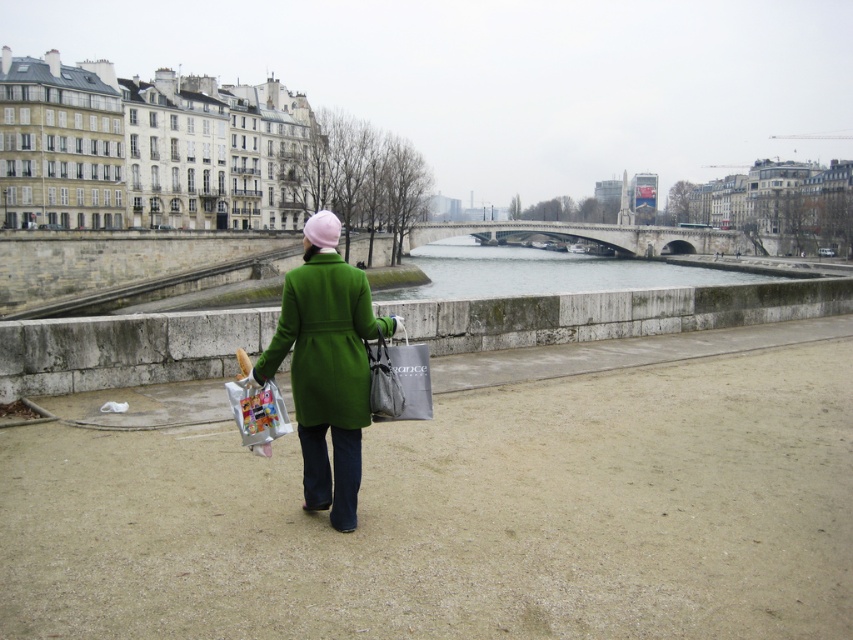
Between green matte coat at center and matte gray bag at center, which one appears on the left side from the viewer's perspective?

From the viewer's perspective, green matte coat at center appears more on the left side.

Is point (341, 337) behind point (374, 384)?

Yes, it is behind point (374, 384).

Image resolution: width=853 pixels, height=640 pixels. I want to click on green matte coat at center, so click(325, 340).

Between point (332, 403) and point (454, 269), which one is positioned in front?

Point (332, 403) is more forward.

In the scene shown: Who is lower down, green matte coat at center or clear water at center?

green matte coat at center is lower down.

This screenshot has width=853, height=640. Describe the element at coordinates (325, 340) in the screenshot. I see `green matte coat at center` at that location.

Where is `green matte coat at center`? The width and height of the screenshot is (853, 640). green matte coat at center is located at coordinates (325, 340).

Who is shorter, clear water at center or matte gray bag at center?

matte gray bag at center

Consider the image. Is clear water at center thinner than matte gray bag at center?

No, clear water at center is not thinner than matte gray bag at center.

Which is behind, point (646, 276) or point (424, 368)?

Point (646, 276)

Identify the location of clear water at center. The width and height of the screenshot is (853, 640). (541, 272).